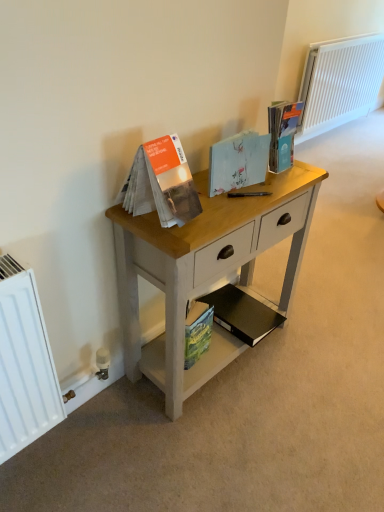
At what (x,y) coordinates should I click in order to perform the action: click on empty space that is to the right of light blue paper at center, the third paperback book positioned from the bottom. Please return your answer as a coordinate pair (x, y). Looking at the image, I should click on (273, 189).